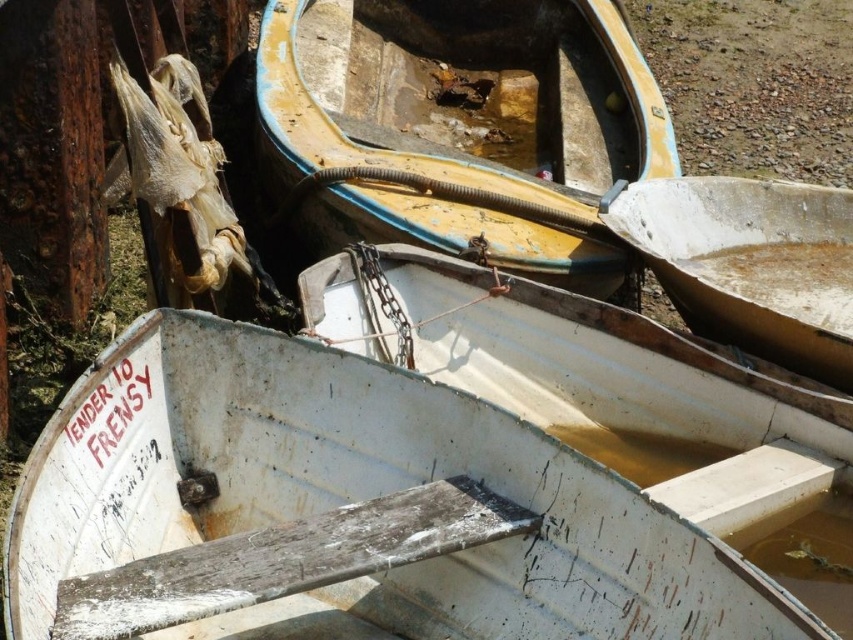
Question: Does yellowish faded wood boat at center appear on the right side of brown gravel at upper right?

Choices:
 (A) no
 (B) yes

Answer: (A)

Question: In this image, where is white matte boat at center located relative to brown gravel at upper right?

Choices:
 (A) left
 (B) right

Answer: (A)

Question: Which is farther from the yellowish faded wood boat at center?

Choices:
 (A) white matte boat at center
 (B) white weathered wood boat at center

Answer: (B)

Question: Which of these objects is positioned farthest from the white weathered wood boat at center?

Choices:
 (A) yellowish faded wood boat at center
 (B) brown gravel at upper right

Answer: (B)

Question: Does white matte boat at center have a lesser width compared to brown gravel at upper right?

Choices:
 (A) yes
 (B) no

Answer: (A)

Question: Which object is closer to the camera taking this photo?

Choices:
 (A) white matte boat at center
 (B) yellowish faded wood boat at center
 (C) white weathered wood boat at center
 (D) brown gravel at upper right

Answer: (C)